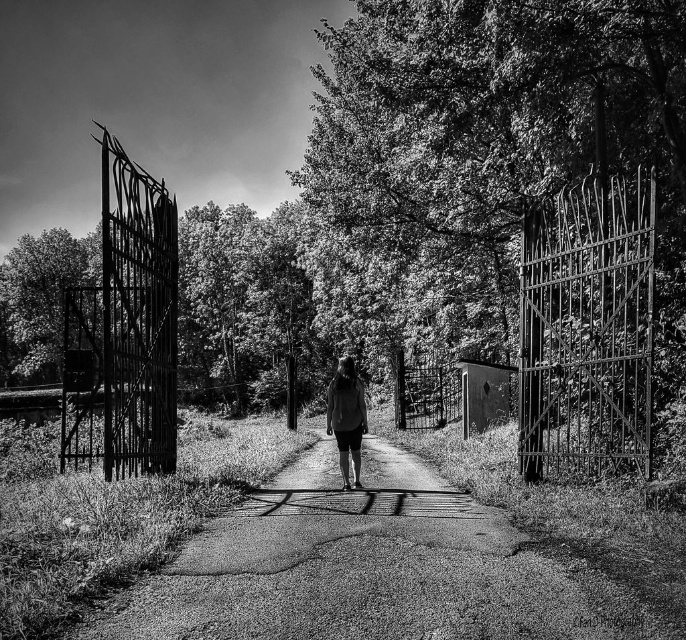
Question: Among these points, which one is farthest from the camera?

Choices:
 (A) (110, 221)
 (B) (539, 577)
 (C) (576, 266)
 (D) (56, 365)

Answer: (D)

Question: Does matte gray shirt at center come in front of rustic wood door at center?

Choices:
 (A) no
 (B) yes

Answer: (B)

Question: Which of the following is the closest to the observer?

Choices:
 (A) (462, 376)
 (B) (560, 392)
 (C) (366, 420)

Answer: (B)

Question: From the image, what is the correct spatial relationship of rusty metal gate at left in relation to matte gray shirt at center?

Choices:
 (A) left
 (B) right

Answer: (A)

Question: Is smooth asphalt road at center below rusty metal gate at left?

Choices:
 (A) no
 (B) yes

Answer: (B)

Question: Which object is the farthest from the rustic wood door at center?

Choices:
 (A) matte gray shirt at center
 (B) smooth asphalt road at center
 (C) green leafy tree at center
 (D) rusty metal gate at left

Answer: (D)